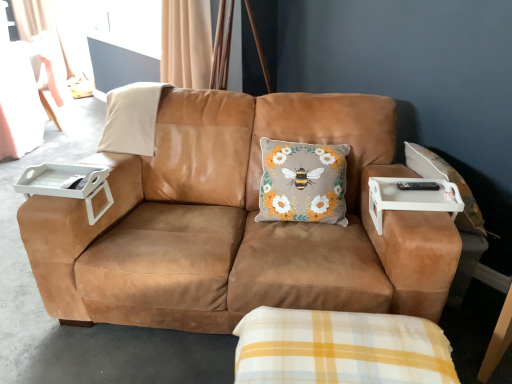
Question: From the image's perspective, is floral-patterned fabric cushion at center on top of beige suede pillow at upper left?

Choices:
 (A) yes
 (B) no

Answer: (B)

Question: Is beige suede pillow at upper left at the back of floral-patterned fabric cushion at center?

Choices:
 (A) no
 (B) yes

Answer: (A)

Question: Can you see floral-patterned fabric cushion at center touching beige suede pillow at upper left?

Choices:
 (A) no
 (B) yes

Answer: (A)

Question: Considering the relative sizes of floral-patterned fabric cushion at center and beige suede pillow at upper left in the image provided, is floral-patterned fabric cushion at center bigger than beige suede pillow at upper left?

Choices:
 (A) yes
 (B) no

Answer: (A)

Question: Does floral-patterned fabric cushion at center have a smaller size compared to beige suede pillow at upper left?

Choices:
 (A) yes
 (B) no

Answer: (B)

Question: From the image's perspective, relative to white plastic tray at left, placed as the second table when sorted from right to left, is beige suede pillow at upper left above or below?

Choices:
 (A) below
 (B) above

Answer: (B)

Question: Does point pos(133,119) appear closer or farther from the camera than point pos(56,180)?

Choices:
 (A) farther
 (B) closer

Answer: (A)

Question: Is beige suede pillow at upper left spatially inside white plastic tray at left, placed as the second table when sorted from right to left, or outside of it?

Choices:
 (A) inside
 (B) outside

Answer: (B)

Question: Is beige suede pillow at upper left bigger or smaller than white plastic tray at left, the first table viewed from the left?

Choices:
 (A) small
 (B) big

Answer: (B)

Question: Considering the positions of point (247, 132) and point (376, 225), is point (247, 132) closer or farther from the camera than point (376, 225)?

Choices:
 (A) farther
 (B) closer

Answer: (A)

Question: From a real-world perspective, is suede brown couch at center physically located above or below white plastic tray at right, the 1th table from the right?

Choices:
 (A) below
 (B) above

Answer: (A)

Question: Looking at their shapes, would you say suede brown couch at center is wider or thinner than white plastic tray at right, the 1th table from the right?

Choices:
 (A) wide
 (B) thin

Answer: (A)

Question: In terms of height, does suede brown couch at center look taller or shorter compared to white plastic tray at right, the second table viewed from the left?

Choices:
 (A) tall
 (B) short

Answer: (A)

Question: In terms of width, does white plastic tray at left, the first table viewed from the left, look wider or thinner when compared to beige suede pillow at upper left?

Choices:
 (A) wide
 (B) thin

Answer: (B)

Question: From a real-world perspective, is white plastic tray at left, placed as the second table when sorted from right to left, positioned above or below beige suede pillow at upper left?

Choices:
 (A) above
 (B) below

Answer: (B)